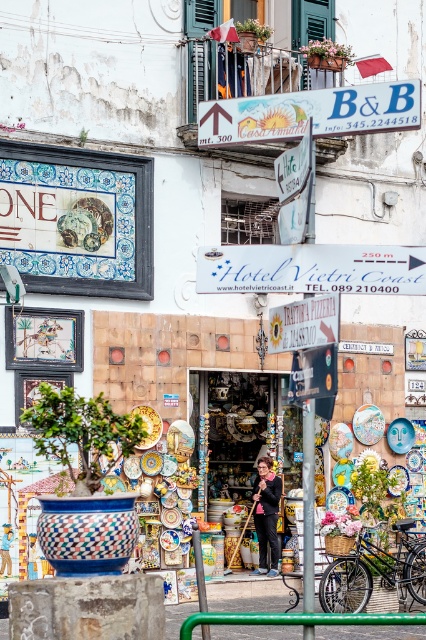
Question: Can you confirm if white plastic sign at center is positioned above white plastic sign at upper center?

Choices:
 (A) no
 (B) yes

Answer: (A)

Question: Is white glossy signboard at center positioned in front of matte blue plate at center?

Choices:
 (A) yes
 (B) no

Answer: (A)

Question: Estimate the real-world distances between objects in this image. Which object is closer to the metallic pole at center?

Choices:
 (A) green metal rail at lower center
 (B) white plastic sign at upper center
 (C) white plastic sign at center

Answer: (A)

Question: From the image, what is the correct spatial relationship of white plastic sign at center in relation to pink fabric jacket at center?

Choices:
 (A) above
 (B) below

Answer: (A)

Question: Among these objects, which one is nearest to the camera?

Choices:
 (A) white plastic sign at upper center
 (B) pink fabric jacket at center

Answer: (A)

Question: Which point is closer to the camera taking this photo?

Choices:
 (A) (305, 460)
 (B) (192, 620)
 (C) (327, 328)
 (D) (255, 500)

Answer: (B)